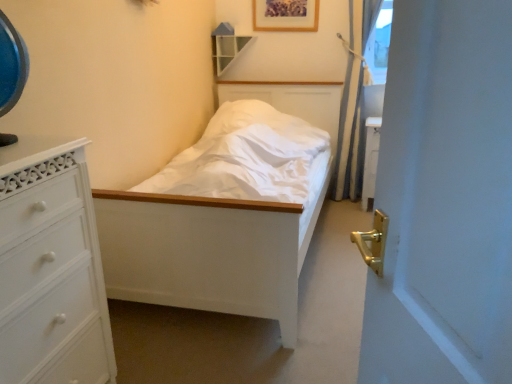
The image size is (512, 384). Describe the element at coordinates (227, 50) in the screenshot. I see `wooden shelf at upper center` at that location.

Describe the element at coordinates (285, 15) in the screenshot. I see `wooden picture frame at upper center` at that location.

I want to click on white painted wood chest of drawers at left, so tap(51, 268).

Identify the location of blue fabric curtain at right. (350, 136).

What's the angular difference between blue fabric curtain at right and white painted wood chest of drawers at left's facing directions?

90 degrees.

The height and width of the screenshot is (384, 512). Find the location of `the chest of drawers beneath the blue fabric curtain at right (from a real-world perspective)`. the chest of drawers beneath the blue fabric curtain at right (from a real-world perspective) is located at coordinates (51, 268).

Is white painted wood chest of drawers at left completely or partially inside blue fabric curtain at right?

That's incorrect, white painted wood chest of drawers at left is not inside blue fabric curtain at right.

Does blue fabric curtain at right have a lesser height compared to white painted wood chest of drawers at left?

No, blue fabric curtain at right is not shorter than white painted wood chest of drawers at left.

Is the depth of wooden picture frame at upper center less than that of white painted wood chest of drawers at left?

No, it is behind white painted wood chest of drawers at left.

Is wooden picture frame at upper center looking in the opposite direction of white painted wood chest of drawers at left?

wooden picture frame at upper center is not turned away from white painted wood chest of drawers at left.

From the image's perspective, is wooden picture frame at upper center located beneath white painted wood chest of drawers at left?

No.

Looking at this image, from a real-world perspective, which object rests below the other?

white painted wood chest of drawers at left, from a real-world perspective.

From a real-world perspective, which is physically below, blue fabric curtain at right or white painted wood bed at center?

From a 3D spatial view, white painted wood bed at center is below.

This screenshot has width=512, height=384. In order to click on bed that appears below the blue fabric curtain at right (from a real-world perspective) in this screenshot , I will do `click(206, 252)`.

Which object is positioned more to the right, blue fabric curtain at right or white painted wood bed at center?

blue fabric curtain at right.

Is blue fabric curtain at right shorter than wooden picture frame at upper center?

No, blue fabric curtain at right is not shorter than wooden picture frame at upper center.

Where is `curtain that appears in front of the wooden picture frame at upper center`? The width and height of the screenshot is (512, 384). curtain that appears in front of the wooden picture frame at upper center is located at coordinates (350, 136).

From the image's perspective, is blue fabric curtain at right on top of wooden picture frame at upper center?

No, from the image's perspective, blue fabric curtain at right is not on top of wooden picture frame at upper center.

Is blue fabric curtain at right smaller than wooden picture frame at upper center?

Incorrect, blue fabric curtain at right is not smaller in size than wooden picture frame at upper center.

From a real-world perspective, who is located lower, white painted wood bed at center or wooden picture frame at upper center?

white painted wood bed at center is physically lower.

Which is closer, (289, 255) or (302, 20)?

Point (289, 255) is positioned closer to the camera compared to point (302, 20).

Could wooden picture frame at upper center be considered to be inside white painted wood bed at center?

No, wooden picture frame at upper center is not surrounded by white painted wood bed at center.

Can you tell me how much white painted wood bed at center and wooden picture frame at upper center differ in facing direction?

The facing directions of white painted wood bed at center and wooden picture frame at upper center are 0.14 degrees apart.

How different are the orientations of wooden shelf at upper center and blue fabric curtain at right in degrees?

The facing directions of wooden shelf at upper center and blue fabric curtain at right are 2.6 degrees apart.

Locate an element on the screen. shelf behind the blue fabric curtain at right is located at coordinates (227, 50).

Does point (229, 35) lie behind point (351, 68)?

That is True.

Is wooden shelf at upper center bigger or smaller than blue fabric curtain at right?

Clearly, wooden shelf at upper center is smaller in size than blue fabric curtain at right.

Where is `shelf above the white painted wood chest of drawers at left (from the image's perspective)`? shelf above the white painted wood chest of drawers at left (from the image's perspective) is located at coordinates (227, 50).

Would you say wooden shelf at upper center is part of white painted wood chest of drawers at left's contents?

Definitely not — wooden shelf at upper center is not inside white painted wood chest of drawers at left.

Between white painted wood chest of drawers at left and wooden shelf at upper center, which one appears on the left side from the viewer's perspective?

From the viewer's perspective, white painted wood chest of drawers at left appears more on the left side.

From a real-world perspective, who is located higher, white painted wood chest of drawers at left or wooden shelf at upper center?

wooden shelf at upper center.

The image size is (512, 384). In order to click on the chest of drawers that appears in front of the blue fabric curtain at right in this screenshot , I will do `click(51, 268)`.

Locate an element on the screen. This screenshot has height=384, width=512. picture frame behind the white painted wood chest of drawers at left is located at coordinates (285, 15).

From the image, which object appears to be nearer to wooden shelf at upper center, white painted wood chest of drawers at left or wooden picture frame at upper center?

wooden picture frame at upper center is positioned closer to the anchor wooden shelf at upper center.

Considering their positions, is wooden shelf at upper center positioned closer to wooden picture frame at upper center than white painted wood chest of drawers at left?

wooden shelf at upper center.

Based on their spatial positions, is white painted wood chest of drawers at left or wooden picture frame at upper center closer to blue fabric curtain at right?

wooden picture frame at upper center is positioned closer to the anchor blue fabric curtain at right.

Looking at the image, which one is located further to blue fabric curtain at right, white painted wood chest of drawers at left or wooden shelf at upper center?

Based on the image, white painted wood chest of drawers at left appears to be further to blue fabric curtain at right.

Considering their positions, is white painted wood bed at center positioned further to blue fabric curtain at right than white painted wood chest of drawers at left?

The object further to blue fabric curtain at right is white painted wood chest of drawers at left.

Based on their spatial positions, is white painted wood bed at center or white painted wood chest of drawers at left further from wooden picture frame at upper center?

white painted wood chest of drawers at left is positioned further to the anchor wooden picture frame at upper center.

Which object lies further to the anchor point white painted wood chest of drawers at left, white painted wood bed at center or blue fabric curtain at right?

blue fabric curtain at right.

Which object lies nearer to the anchor point wooden shelf at upper center, blue fabric curtain at right or white painted wood chest of drawers at left?

The object closer to wooden shelf at upper center is blue fabric curtain at right.

The width and height of the screenshot is (512, 384). I want to click on curtain between white painted wood chest of drawers at left and wooden picture frame at upper center along the z-axis, so click(350, 136).

Identify the location of picture frame between wooden shelf at upper center and blue fabric curtain at right. Image resolution: width=512 pixels, height=384 pixels. (285, 15).

Locate an element on the screen. picture frame positioned between white painted wood chest of drawers at left and wooden shelf at upper center from near to far is located at coordinates (285, 15).

What are the coordinates of `curtain between white painted wood bed at center and wooden picture frame at upper center in the front-back direction` in the screenshot? It's located at (350, 136).